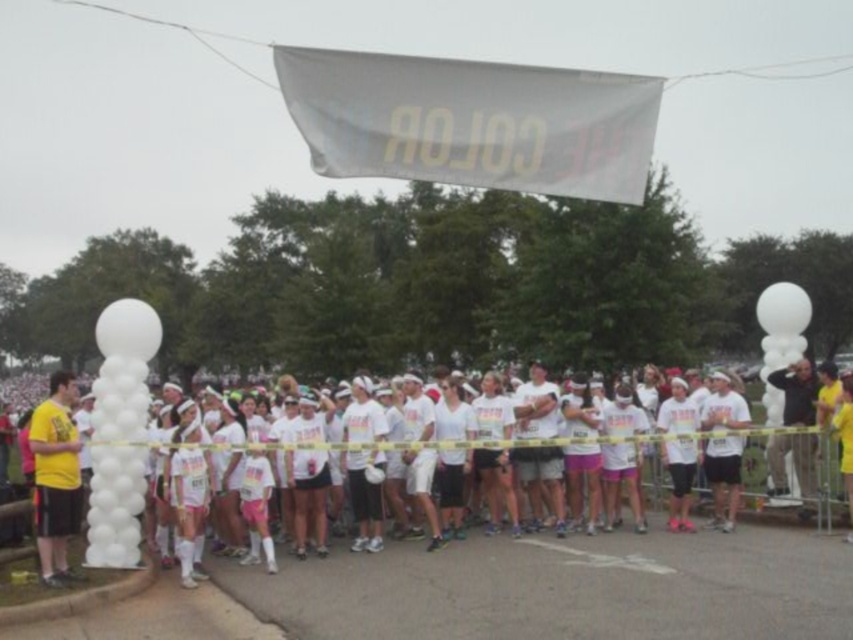
Can you confirm if white matte balloon at center is positioned above dark gray jacket at right?

Actually, white matte balloon at center is below dark gray jacket at right.

Which is more to the right, white matte balloon at center or dark gray jacket at right?

From the viewer's perspective, dark gray jacket at right appears more on the right side.

Where is `white matte balloon at center`? This screenshot has width=853, height=640. white matte balloon at center is located at coordinates (677, 451).

Who is more forward, (231, 445) or (38, 518)?

Positioned in front is point (38, 518).

Who is higher up, white matte balloon at center or yellow matte t-shirt at left?

white matte balloon at center is higher up.

Measure the distance between point (398, 445) and camera.

A distance of 11.00 meters exists between point (398, 445) and camera.

Image resolution: width=853 pixels, height=640 pixels. What are the coordinates of `white matte balloon at center` in the screenshot? It's located at (677, 451).

Can you confirm if white fabric banner at upper center is positioned below yellow matte t-shirt at left?

No.

Is white fabric banner at upper center closer to camera compared to yellow matte t-shirt at left?

Yes.

Find the location of a particular element. white fabric banner at upper center is located at coordinates (473, 122).